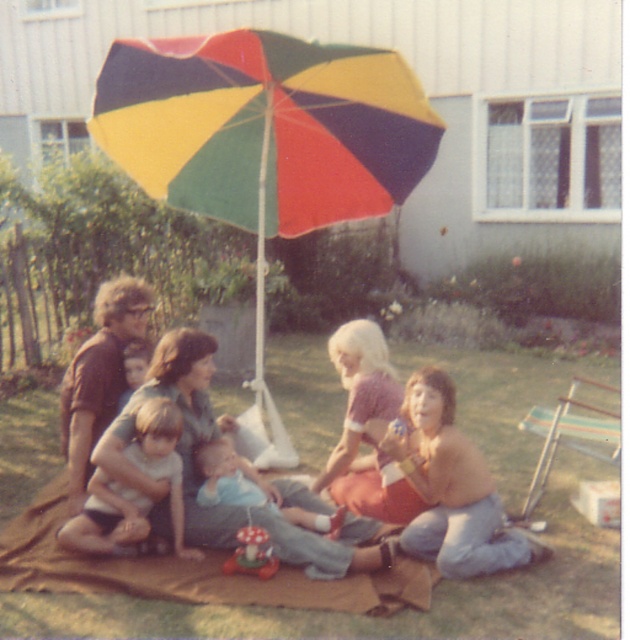
You are a photographer setting up a shot of the family gathering. You want to ensure that both the matte gray shirt at center and the light brown fabric shorts at lower left are clearly visible in the photo. Based on their positions, which object should you adjust your focus on to ensure both are in frame?

The matte gray shirt at center is in front of the light brown fabric shorts at lower left. To ensure both are in frame, focus on the matte gray shirt at center first, then adjust to include the light brown fabric shorts at lower left behind it.

You are standing at the camera position and want to know how far the point at coordinates (x=151, y=115) is from you. Can you determine the distance?

The distance of point (x=151, y=115) from camera is 5.21 meters.